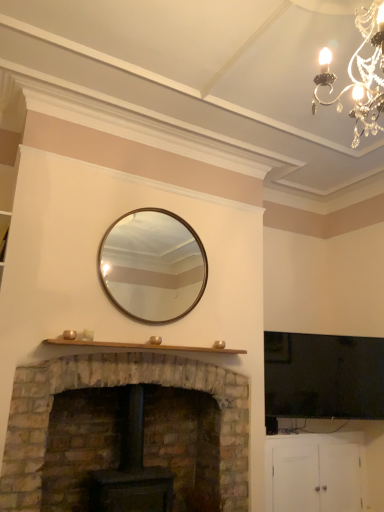
Question: Is silver metallic mirror at center taller or shorter than rustic stone fireplace at lower left?

Choices:
 (A) short
 (B) tall

Answer: (A)

Question: Considering the positions of silver metallic mirror at center and rustic stone fireplace at lower left in the image, is silver metallic mirror at center wider or thinner than rustic stone fireplace at lower left?

Choices:
 (A) wide
 (B) thin

Answer: (B)

Question: Considering the real-world distances, which object is closest to the silver metallic mirror at center?

Choices:
 (A) white matte cabinet at lower right
 (B) crystal chandelier at upper right
 (C) rustic stone fireplace at lower left

Answer: (C)

Question: Estimate the real-world distances between objects in this image. Which object is farther from the rustic stone fireplace at lower left?

Choices:
 (A) crystal chandelier at upper right
 (B) white matte cabinet at lower right
 (C) silver metallic mirror at center

Answer: (A)